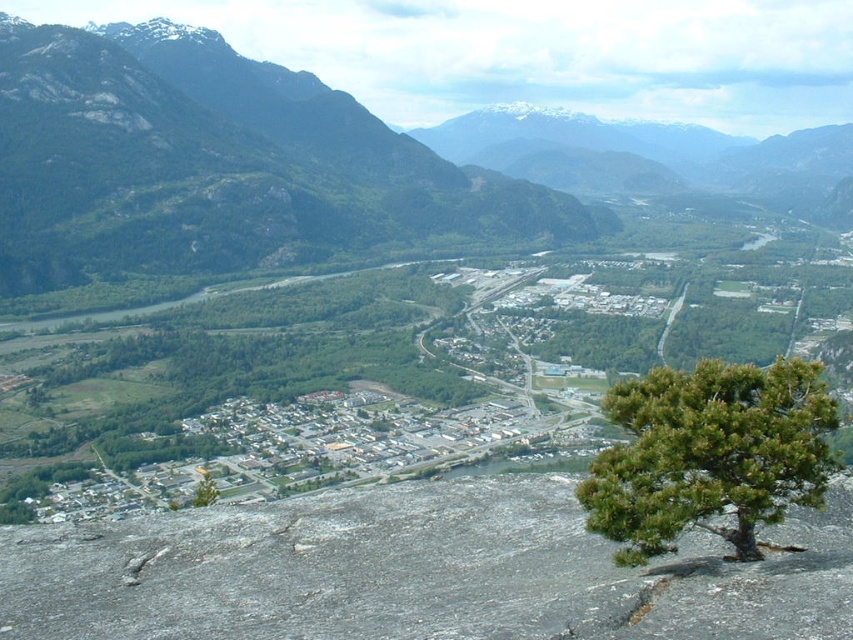
Question: Observing the image, what is the correct spatial positioning of green textured tree at lower right in reference to green matte tree at lower left?

Choices:
 (A) left
 (B) right

Answer: (B)

Question: Can you confirm if green textured tree at lower right is wider than green matte tree at lower left?

Choices:
 (A) no
 (B) yes

Answer: (A)

Question: Which point is closer to the camera taking this photo?

Choices:
 (A) (207, 481)
 (B) (767, 472)

Answer: (B)

Question: Which point is farther to the camera?

Choices:
 (A) (753, 452)
 (B) (196, 496)

Answer: (B)

Question: Among these objects, which one is farthest from the camera?

Choices:
 (A) green textured tree at lower right
 (B) green matte tree at lower left

Answer: (B)

Question: Can you confirm if green textured tree at lower right is thinner than green matte tree at lower left?

Choices:
 (A) no
 (B) yes

Answer: (B)